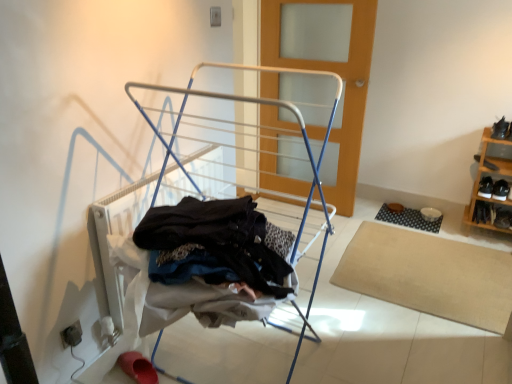
Find the location of `free space underneath beige carpet at lower right, the first mat from the front (from a real-world perspective)`. free space underneath beige carpet at lower right, the first mat from the front (from a real-world perspective) is located at coordinates (431, 266).